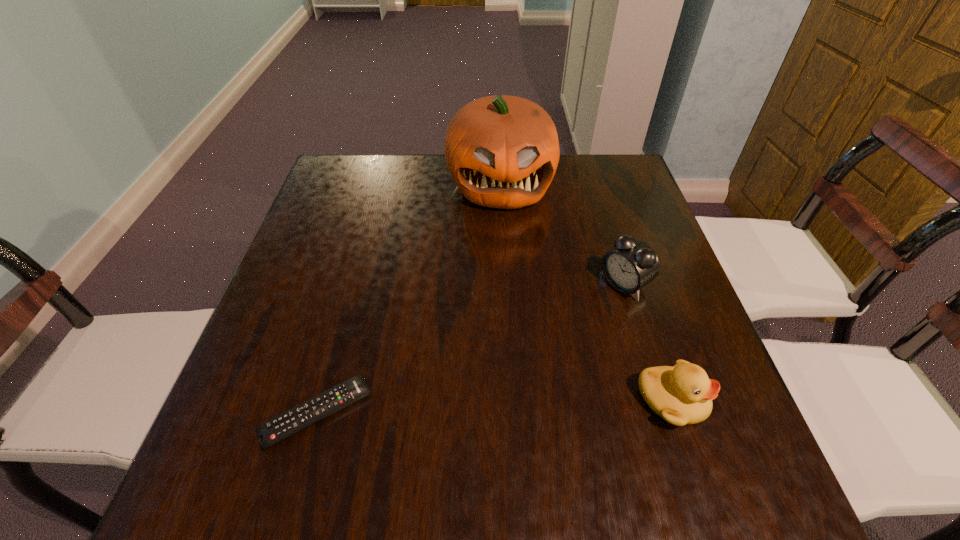
Where is `object that is at the near left corner`? object that is at the near left corner is located at coordinates pos(271,432).

This screenshot has width=960, height=540. What are the coordinates of `object positioned at the near right corner` in the screenshot? It's located at (682, 395).

In the image, there is a desktop. Where is `free space at the far edge`? free space at the far edge is located at coordinates [x=574, y=192].

This screenshot has height=540, width=960. Identify the location of vacant space at the near edge of the desktop. [x=382, y=414].

I want to click on vacant space at the left edge of the desktop, so click(x=299, y=272).

Image resolution: width=960 pixels, height=540 pixels. In the image, there is a desktop. Find the location of `vacant space at the right edge`. vacant space at the right edge is located at coordinates pyautogui.click(x=636, y=202).

In the image, there is a desktop. At what (x,y) coordinates should I click in order to perform the action: click on free space at the far left corner. Please return your answer as a coordinate pair (x, y). The height and width of the screenshot is (540, 960). Looking at the image, I should click on (346, 179).

This screenshot has height=540, width=960. In order to click on vacant space at the far right corner in this screenshot , I will do `click(592, 198)`.

Where is `empty space that is in between the third tallest object and the remote control`? This screenshot has height=540, width=960. empty space that is in between the third tallest object and the remote control is located at coordinates (494, 407).

Find the location of `vacant space in between the remote control and the second shortest object`. vacant space in between the remote control and the second shortest object is located at coordinates (494, 407).